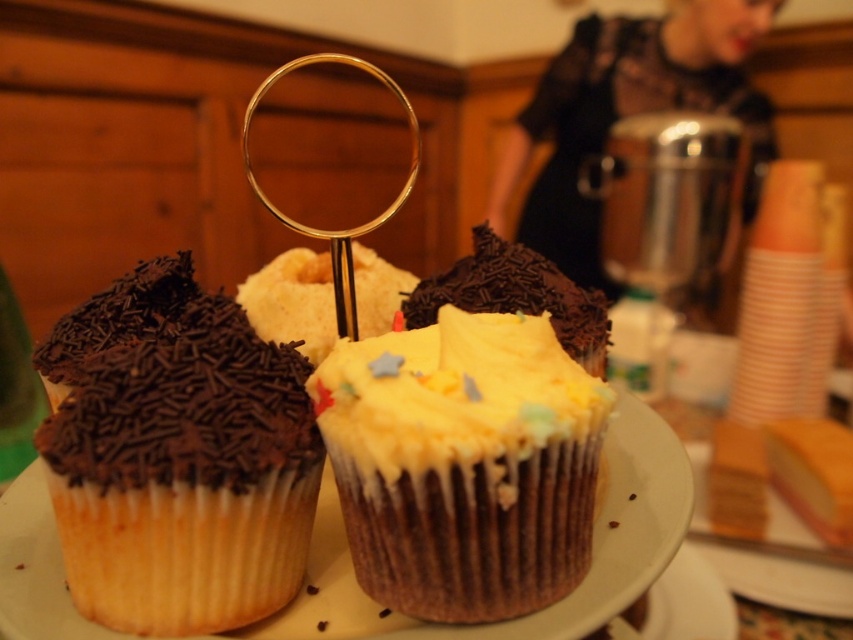
Based on the photo, you are at a party and notice a gold metallic magnifying glass at center on a cupcake plate. If you want to pick it up, which direction should you move relative to the cupcakes?

The gold metallic magnifying glass at center is located at point coordinates, so you should move towards the center of the plate to pick it up.

Consider the image. Please provide the exact coordinates of the yellow frosting cupcake at center in the image grid system where the origin is at the bottom left corner.

The yellow frosting cupcake at center is located at coordinates point (463, 464).